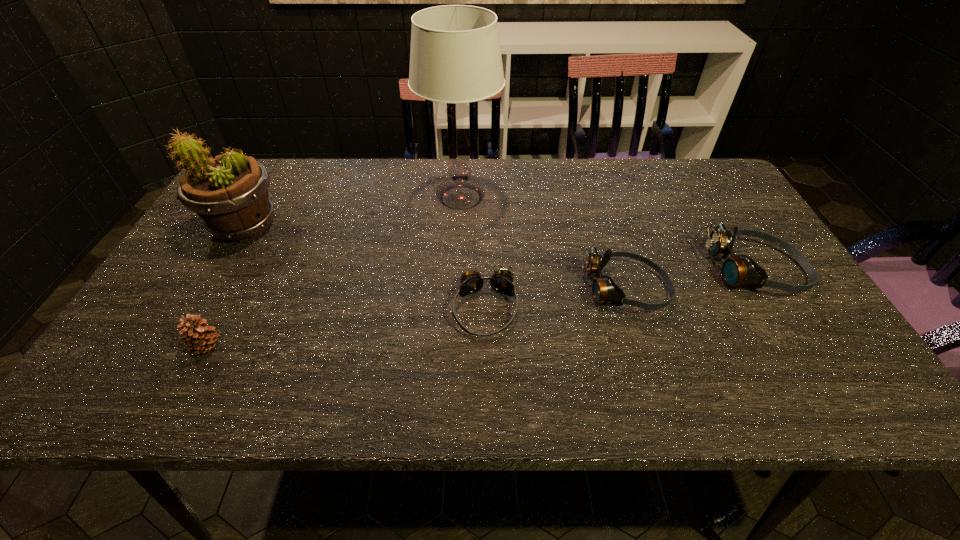
Point out which goggles is positioned as the third nearest to the table lamp. Please provide its 2D coordinates. Your answer should be formatted as a tuple, i.e. [(x, y)], where the tuple contains the x and y coordinates of a point satisfying the conditions above.

[(740, 270)]

This screenshot has height=540, width=960. In order to click on blank area in the image that satisfies the following two spatial constraints: 1. through the lenses of the second shortest goggles; 2. on the front side of the pinecone in this screenshot , I will do `click(643, 346)`.

You are a GUI agent. You are given a task and a screenshot of the screen. Output one action in this format:
    pyautogui.click(x=<x>, y=<y>)
    Task: Click on the free space that satisfies the following two spatial constraints: 1. through the lenses of the fifth object from left to right; 2. through the lenses of the shortest object
    This screenshot has height=540, width=960.
    Given the screenshot: What is the action you would take?
    pyautogui.click(x=632, y=309)

The image size is (960, 540). I want to click on vacant space that satisfies the following two spatial constraints: 1. through the lenses of the rightmost goggles; 2. through the lenses of the leftmost goggles, so click(780, 309).

Locate an element on the screen. vacant region that satisfies the following two spatial constraints: 1. through the lenses of the second goggles from right to left; 2. through the lenses of the shortest object is located at coordinates (632, 309).

Image resolution: width=960 pixels, height=540 pixels. I want to click on free point that satisfies the following two spatial constraints: 1. through the lenses of the rightmost object; 2. through the lenses of the shortest object, so click(x=780, y=309).